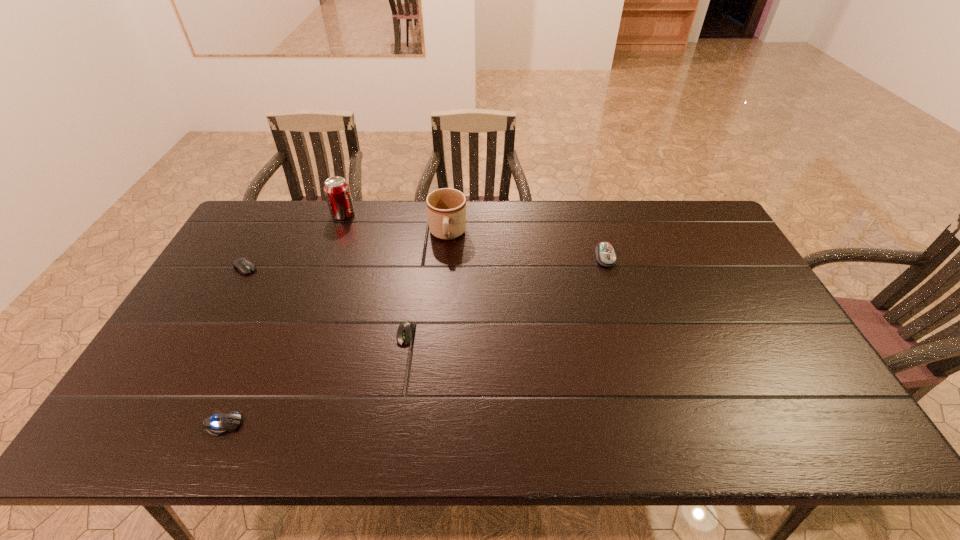
Locate an element on the screen. soda can is located at coordinates (337, 191).

Identify the location of the fifth object from left to right. This screenshot has width=960, height=540. (446, 208).

Locate an element on the screen. the third tallest object is located at coordinates (605, 254).

Locate an element on the screen. the rightmost computer mouse is located at coordinates (605, 254).

I want to click on the leftmost computer mouse, so click(x=243, y=265).

Where is `the second computer mouse from right to left`? This screenshot has width=960, height=540. the second computer mouse from right to left is located at coordinates (405, 331).

Find the location of a particular element. This screenshot has width=960, height=540. the second nearest computer mouse is located at coordinates pyautogui.click(x=405, y=331).

Where is `the nearest computer mouse`? the nearest computer mouse is located at coordinates (220, 423).

This screenshot has width=960, height=540. Find the location of `the nearest object`. the nearest object is located at coordinates (220, 423).

Locate an element on the screen. vacant space located 0.270m on the front of the third object from left to right is located at coordinates (321, 274).